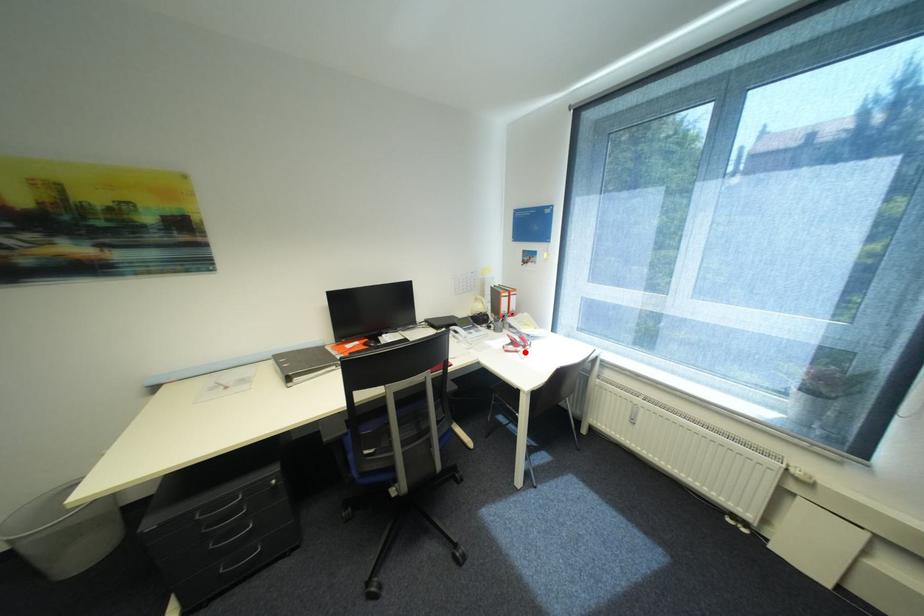
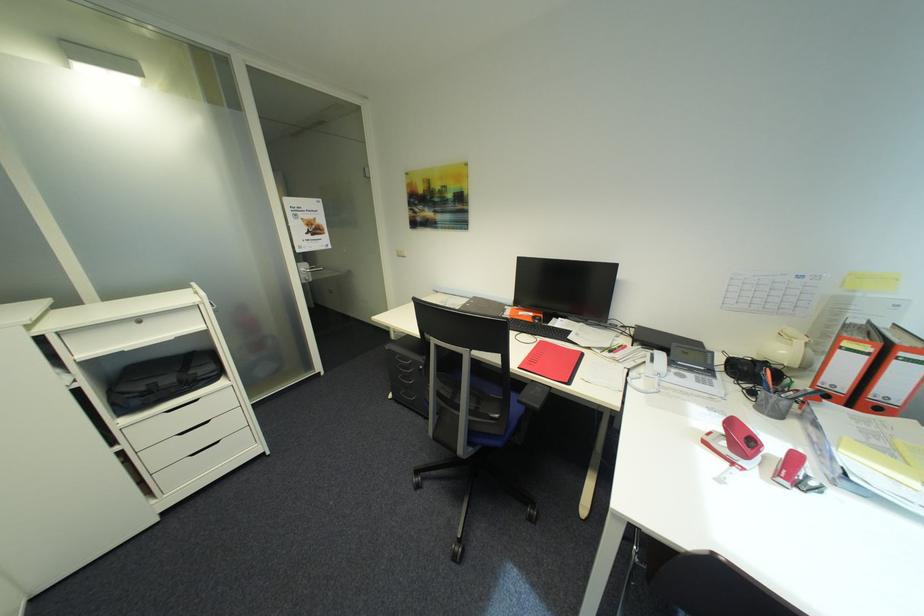
Where in the second image is the point corresponding to the highlighted location from the first image?

(742, 464)